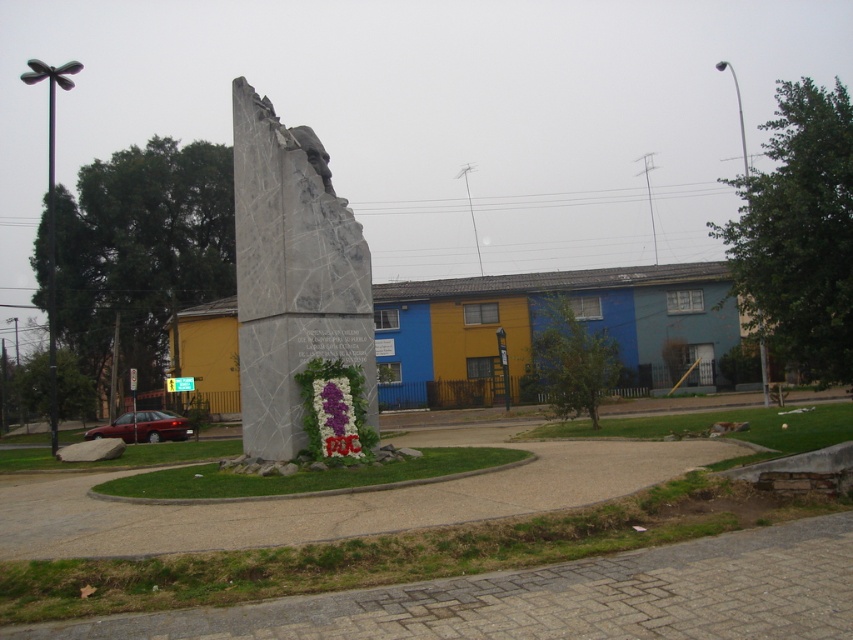
Question: Is gray marble statue at center below purple fabric flower at center?

Choices:
 (A) no
 (B) yes

Answer: (A)

Question: Can you confirm if gray marble statue at center is positioned above purple fabric flower at center?

Choices:
 (A) no
 (B) yes

Answer: (B)

Question: Is gray marble statue at center wider than purple fabric flower at center?

Choices:
 (A) no
 (B) yes

Answer: (B)